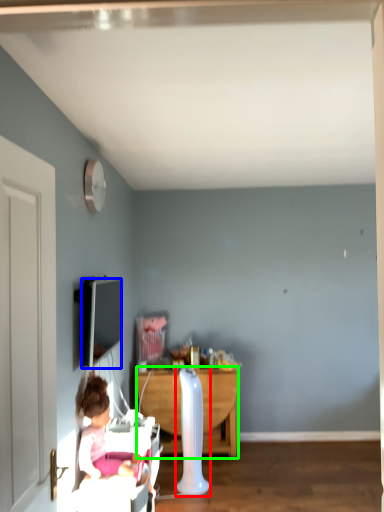
Question: Which object is positioned farthest from radiator (highlighted by a red box)? Select from television (highlighted by a blue box) and desk (highlighted by a green box).

Choices:
 (A) television
 (B) desk

Answer: (A)